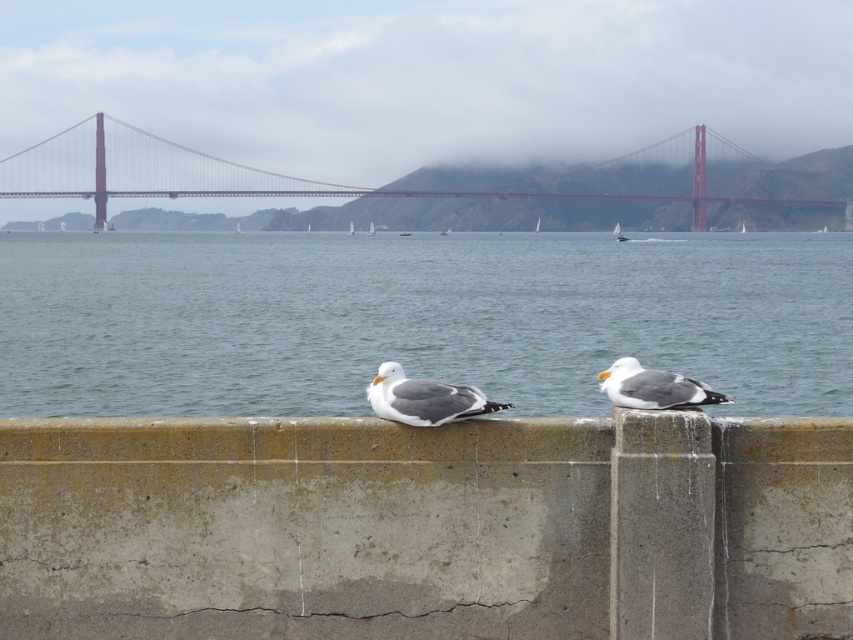
Can you confirm if concrete at center is bigger than blue water at center?

No.

Does point (41, 513) come farther from viewer compared to point (730, 273)?

No, it is not.

Locate an element on the screen. The width and height of the screenshot is (853, 640). concrete at center is located at coordinates (426, 528).

Based on the photo, is concrete at center further to camera compared to red metal bridge at center?

That is False.

Who is more forward, (335, 624) or (64, 189)?

Positioned in front is point (335, 624).

Where is `concrete at center`? The width and height of the screenshot is (853, 640). concrete at center is located at coordinates (426, 528).

Is concrete at center shorter than gray feathered seagull at center?

No.

Is concrete at center in front of gray feathered seagull at center?

Yes.

Find the location of a particular element. concrete at center is located at coordinates [x=426, y=528].

Locate an element on the screen. concrete at center is located at coordinates (426, 528).